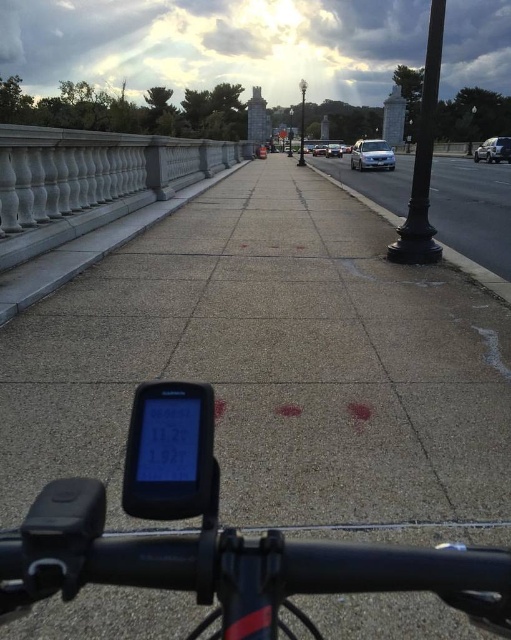
You are riding a bicycle on the bridge and see a silver metallic sedan at upper right and a white glossy sedan at center. Which car appears larger in size?

The silver metallic sedan at upper right appears larger in size than the white glossy sedan at center.

You are riding a bicycle on the bridge and notice the gray concrete sidewalk at right and the silver metallic sedan at upper right. Which object is positioned lower in the scene?

The gray concrete sidewalk at right is positioned below the silver metallic sedan at upper right, so it is lower in the scene.

You are riding a bicycle on the bridge and looking at the GPS device on your handlebars. There is a point marked at coordinates (494, 148). What object does this point correspond to?

The point at coordinates (494, 148) corresponds to the silver metallic sedan at upper right.